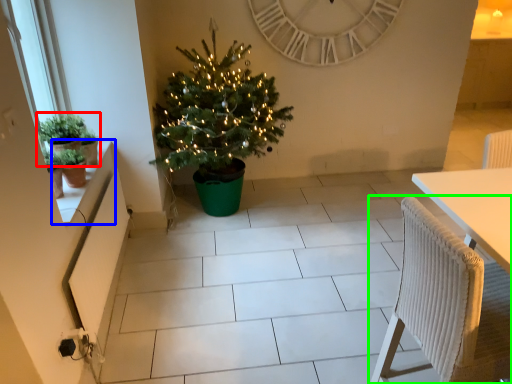
Question: Which is nearer to the houseplant (highlighted by a red box)? window sill (highlighted by a blue box) or chair (highlighted by a green box).

Choices:
 (A) window sill
 (B) chair

Answer: (A)